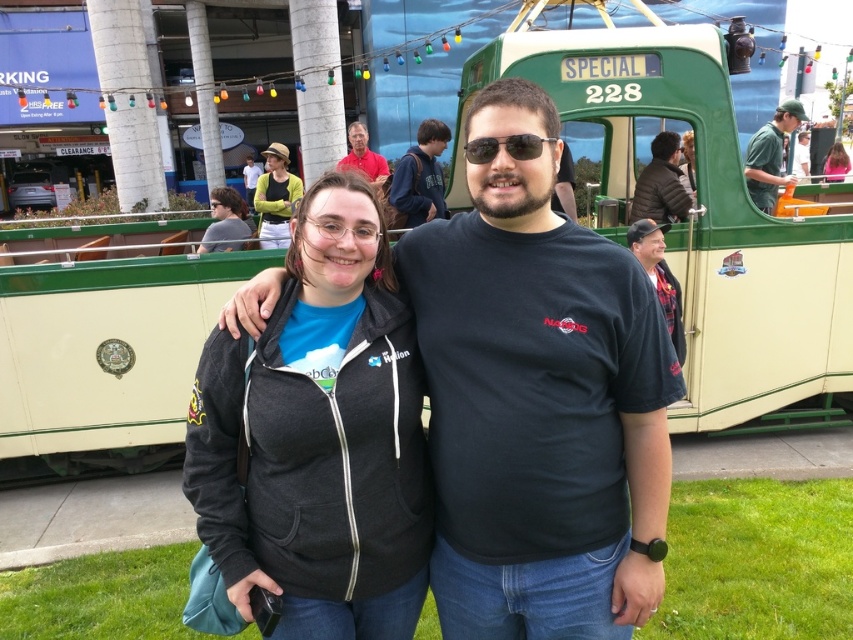
You are taking a photo of the tram with two people standing in front of it. You want to focus on the point closer to the camera. Which point should you choose between point (584, 570) and point (651, 161)?

Point (584, 570) is closer to the camera than point (651, 161), so you should choose point (584, 570) to focus on.

You are a photographer taking a picture of the brown hair at center and the yellow fabric hat at upper center. Which object should you adjust to ensure both are centered in the frame?

The brown hair at center is positioned on the right side of yellow fabric hat at upper center, so you should move the brown hair at center to the left to align both objects in the center of the frame.